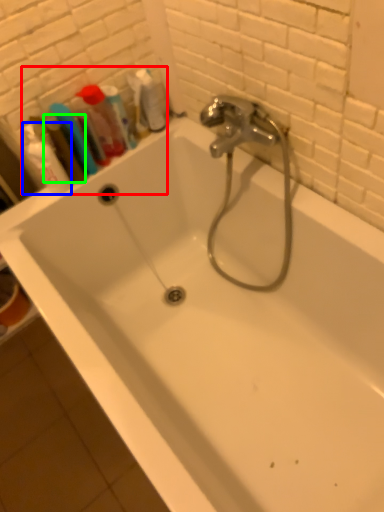
Question: Which object is positioned farthest from toiletry (highlighted by a red box)? Select from shaving cream (highlighted by a blue box) and mouthwash (highlighted by a green box).

Choices:
 (A) shaving cream
 (B) mouthwash

Answer: (A)